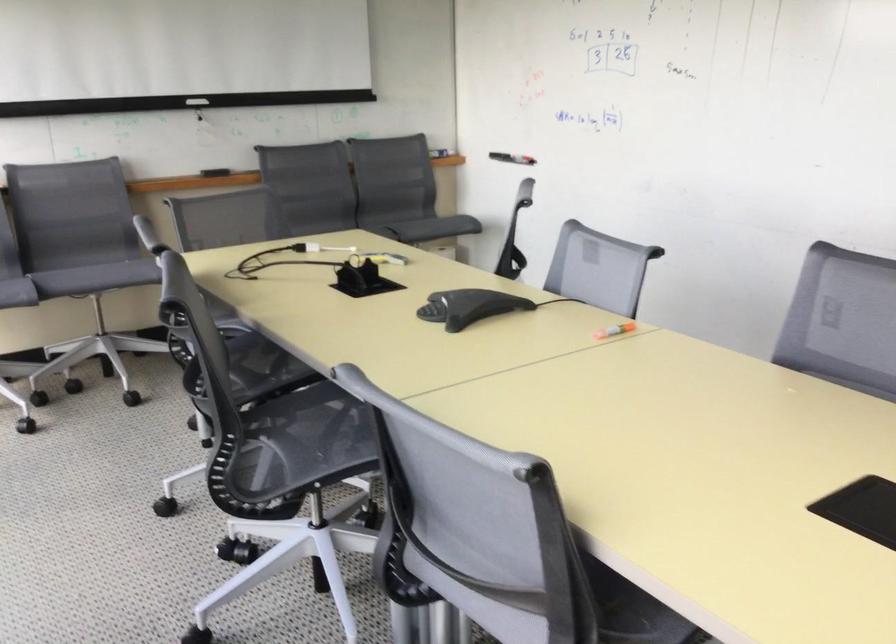
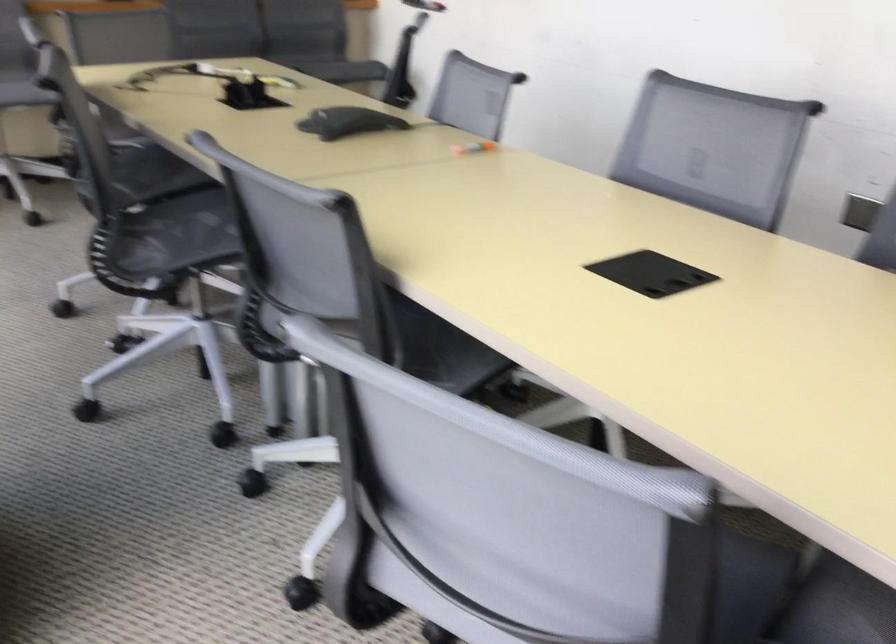
The point at (613,328) is marked in the first image. Where is the corresponding point in the second image?

(474, 147)